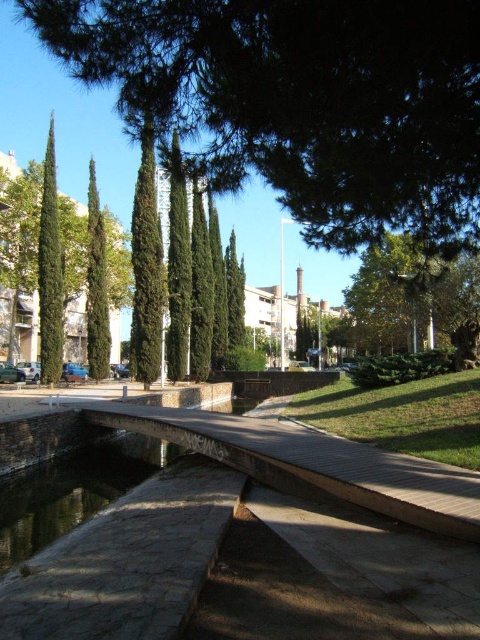
You are standing on the wooden walkway in the park and want to know which object is taller between the smooth stone water at lower left and the green leafy tree at center. Can you tell me?

The smooth stone water at lower left has a lesser height compared to green leafy tree at center, so the green leafy tree at center is taller.

You are a park visitor who wants to place a small wooden bench between the smooth stone water at lower left and the green leafy tree at center. The bench is 1.5 meters long. Is there enough space between them to place the bench without moving either object?

The distance between the smooth stone water at lower left and the green leafy tree at center is 20.19 meters. Since the bench is only 1.5 meters long, there is more than enough space to place it between them without needing to move either object.